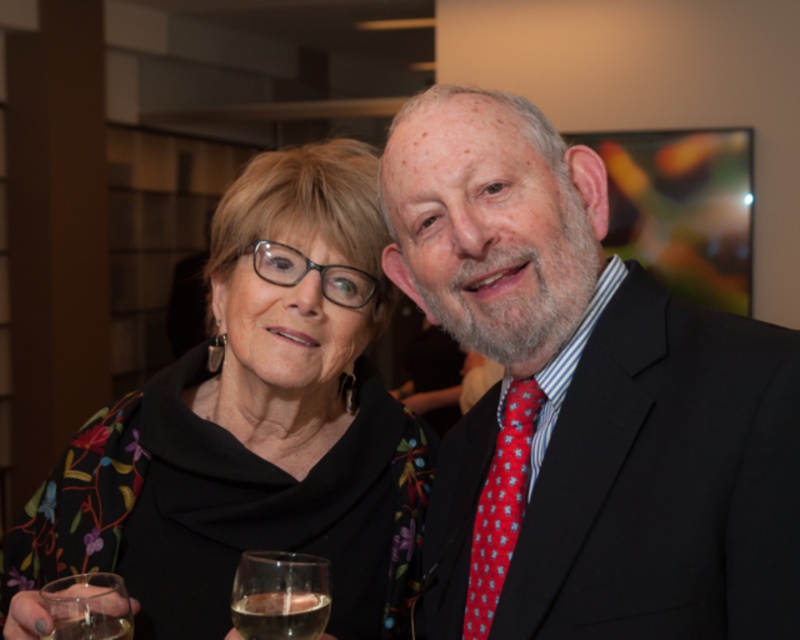
Question: Which object is positioned farthest from the matte black suit at right?

Choices:
 (A) transparent glass at lower left
 (B) clear glass wine glass at lower left
 (C) red dotted fabric tie at right

Answer: (A)

Question: Among these objects, which one is nearest to the camera?

Choices:
 (A) transparent glass at lower left
 (B) red dotted fabric tie at right
 (C) floral-patterned fabric at center
 (D) matte black suit at right

Answer: (D)

Question: Which object is the closest to the matte black suit at right?

Choices:
 (A) floral-patterned fabric at center
 (B) red dotted fabric tie at right

Answer: (B)

Question: Does red dotted fabric tie at right appear under clear glass wine glass at lower left?

Choices:
 (A) yes
 (B) no

Answer: (B)

Question: Does floral-patterned fabric at center lie in front of transparent glass at lower left?

Choices:
 (A) yes
 (B) no

Answer: (B)

Question: Is floral-patterned fabric at center thinner than clear glass wine glass at lower left?

Choices:
 (A) yes
 (B) no

Answer: (B)